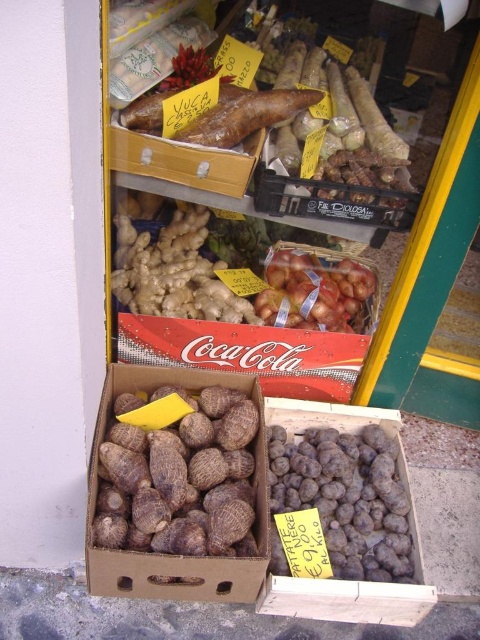
Question: Is the position of brown rough taro at center less distant than that of brown rough taro at lower center?

Choices:
 (A) no
 (B) yes

Answer: (B)

Question: Considering the relative positions of brown rough taro at lower center and shiny brown onions at center in the image provided, where is brown rough taro at lower center located with respect to shiny brown onions at center?

Choices:
 (A) left
 (B) right

Answer: (B)

Question: Which object is the farthest from the brown rough taro at lower center?

Choices:
 (A) shiny brown onions at center
 (B) brown rough taro at center

Answer: (A)

Question: Which point is farther to the camera?

Choices:
 (A) brown rough taro at center
 (B) brown rough taro at lower center

Answer: (B)

Question: Is brown rough taro at center thinner than shiny brown onions at center?

Choices:
 (A) yes
 (B) no

Answer: (B)

Question: Which point is closer to the camera?

Choices:
 (A) (381, 580)
 (B) (101, 456)
 (C) (332, 326)

Answer: (B)